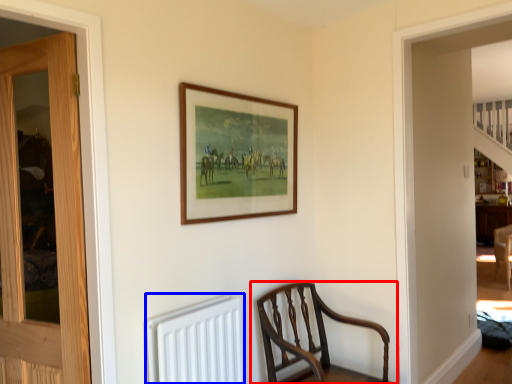
Question: Which object is further to the camera taking this photo, chair (highlighted by a red box) or radiator (highlighted by a blue box)?

Choices:
 (A) chair
 (B) radiator

Answer: (A)